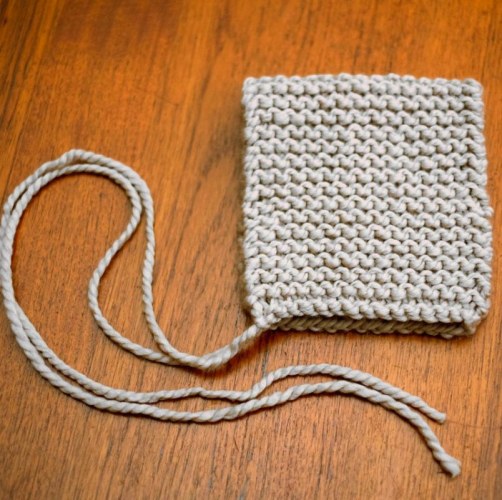
This screenshot has width=502, height=500. In order to click on wood floor see at bottom of image in this screenshot , I will do click(131, 476), click(200, 475), click(349, 472).